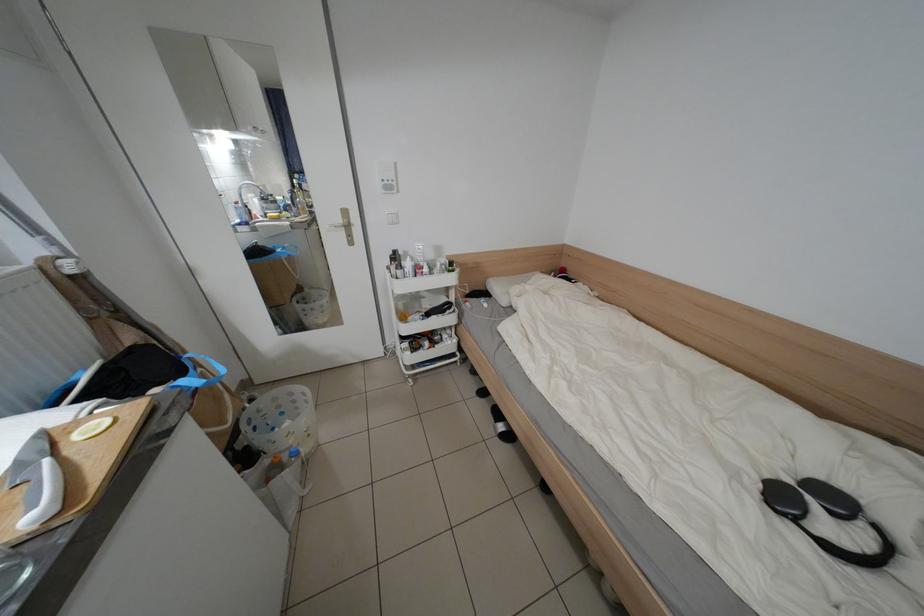
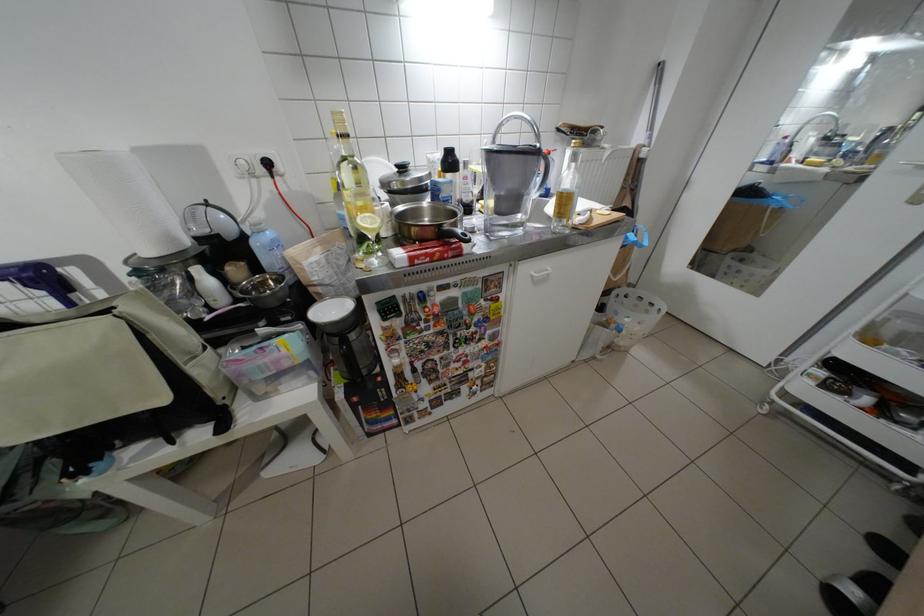
The first image is from the beginning of the video and the second image is from the end. How did the camera likely rotate when shooting the video?

The camera's rotation is toward left-down.